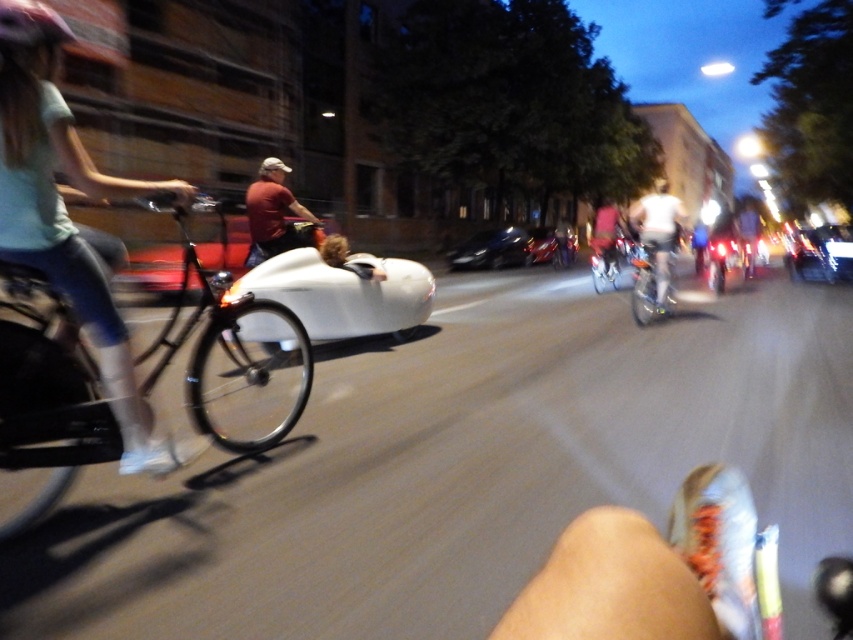
Between shiny silver bicycle at center and metallic silver bicycle at center, which one has less height?

metallic silver bicycle at center is shorter.

Based on the photo, measure the distance between shiny silver bicycle at center and camera.

shiny silver bicycle at center is 9.16 meters away from camera.

You are a GUI agent. You are given a task and a screenshot of the screen. Output one action in this format:
    pyautogui.click(x=<x>, y=<y>)
    Task: Click on the shiny silver bicycle at center
    This screenshot has height=640, width=853.
    Given the screenshot: What is the action you would take?
    pyautogui.click(x=650, y=282)

Describe the element at coordinates (73, 234) in the screenshot. The width and height of the screenshot is (853, 640). I see `matte teal shirt at left` at that location.

Is matte teal shirt at left bigger than white matte bicycle at center?

Actually, matte teal shirt at left might be smaller than white matte bicycle at center.

Who is more forward, (3, 80) or (662, 308)?

Point (3, 80) is in front.

Where is `matte teal shirt at left`? matte teal shirt at left is located at coordinates (73, 234).

Is matte teal shirt at left bigger than matte pink helmet at upper left?

Indeed, matte teal shirt at left has a larger size compared to matte pink helmet at upper left.

Does matte teal shirt at left have a lesser width compared to matte pink helmet at upper left?

Incorrect, matte teal shirt at left's width is not less than matte pink helmet at upper left's.

Is point (9, 246) farther from camera compared to point (61, 32)?

No, it is in front of (61, 32).

The height and width of the screenshot is (640, 853). I want to click on matte teal shirt at left, so click(73, 234).